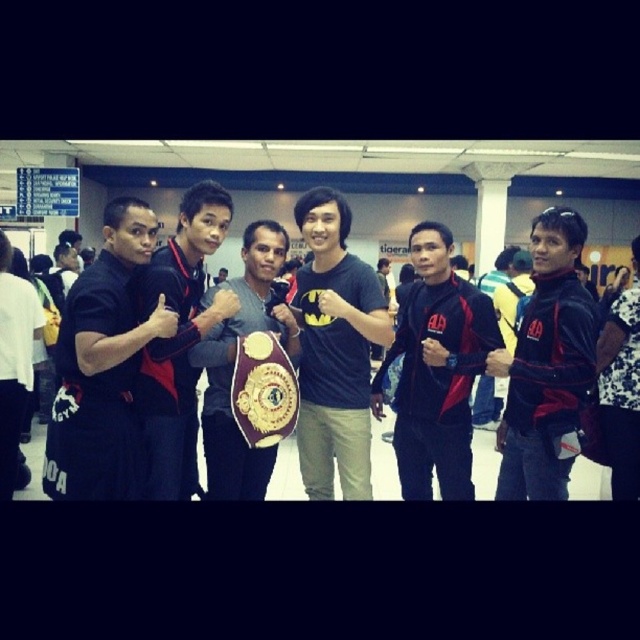
Can you confirm if black matte t-shirt at center is shorter than white floral shirt at right?

In fact, black matte t-shirt at center may be taller than white floral shirt at right.

Does point (369, 416) lie in front of point (627, 422)?

Yes.

Does point (346, 468) lie behind point (632, 442)?

No.

Where is `black matte t-shirt at center`? The height and width of the screenshot is (640, 640). black matte t-shirt at center is located at coordinates (333, 349).

Based on the photo, can you confirm if black fabric pants at left is thinner than matte black shirt at left?

Yes.

Does black fabric pants at left have a lesser height compared to matte black shirt at left?

No.

Who is more forward, (141,253) or (52,266)?

Point (141,253)

Where is `black fabric pants at left`? black fabric pants at left is located at coordinates (104, 365).

Who is positioned more to the right, black fabric pants at left or black matte t-shirt at center?

black matte t-shirt at center is more to the right.

Image resolution: width=640 pixels, height=640 pixels. What do you see at coordinates (104, 365) in the screenshot? I see `black fabric pants at left` at bounding box center [104, 365].

The image size is (640, 640). Identify the location of black fabric pants at left. (104, 365).